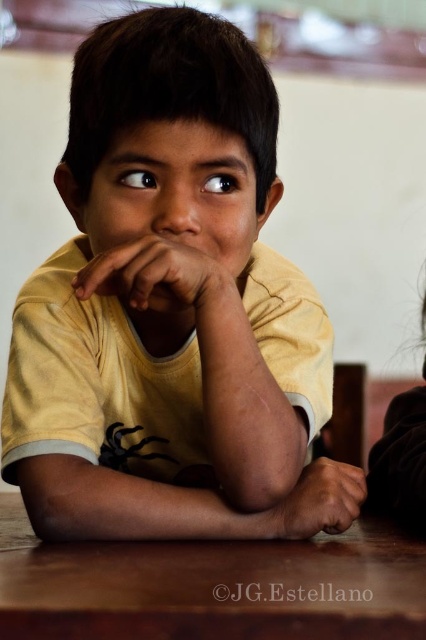
You are a GUI agent. You are given a task and a screenshot of the screen. Output one action in this format:
    pyautogui.click(x=<x>, y=<y>)
    Task: Click on the yellow matte shirt at center
    Image resolution: width=426 pixels, height=640 pixels.
    Given the screenshot: What is the action you would take?
    pyautogui.click(x=164, y=300)

Is point (203, 260) positioned before point (357, 620)?

No, it is not.

Find the location of a particular element. This screenshot has height=640, width=426. yellow matte shirt at center is located at coordinates (164, 300).

Does yellow matte shirt at center have a lesser height compared to matte yellow shirt at center?

Incorrect, yellow matte shirt at center's height does not fall short of matte yellow shirt at center's.

Does yellow matte shirt at center appear over matte yellow shirt at center?

Correct, yellow matte shirt at center is located above matte yellow shirt at center.

Between point (173, 164) and point (97, 276), which one is positioned behind?

Positioned behind is point (173, 164).

Find the location of a particular element. The width and height of the screenshot is (426, 640). yellow matte shirt at center is located at coordinates (164, 300).

Is point (135, 268) more distant than point (322, 486)?

No, (135, 268) is in front of (322, 486).

Image resolution: width=426 pixels, height=640 pixels. I want to click on matte yellow shirt at center, so click(158, 276).

Is point (230, 296) positioned behind point (311, 472)?

No.

Where is `matte yellow shirt at center`? matte yellow shirt at center is located at coordinates (158, 276).